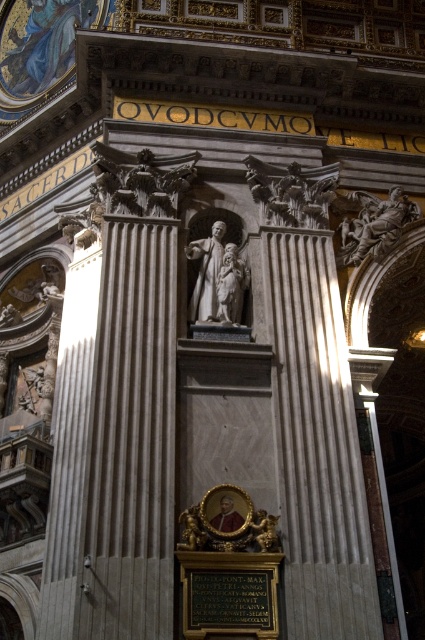
Question: Does white marble statue at center appear on the right side of polished marble statue at upper right?

Choices:
 (A) no
 (B) yes

Answer: (A)

Question: Can you confirm if white marble statue at center is wider than polished marble statue at upper right?

Choices:
 (A) yes
 (B) no

Answer: (B)

Question: Which object is the farthest from the carved stone angel at center?

Choices:
 (A) polished marble statue at upper right
 (B) white marble statue at center

Answer: (B)

Question: Which of the following is the farthest from the observer?

Choices:
 (A) (333, 189)
 (B) (218, 317)
 (C) (396, 234)

Answer: (C)

Question: Among these points, which one is nearest to the camera?

Choices:
 (A) (382, 216)
 (B) (235, 262)
 (C) (249, 176)

Answer: (B)

Question: Is carved stone angel at center smaller than white marble statue at center?

Choices:
 (A) yes
 (B) no

Answer: (A)